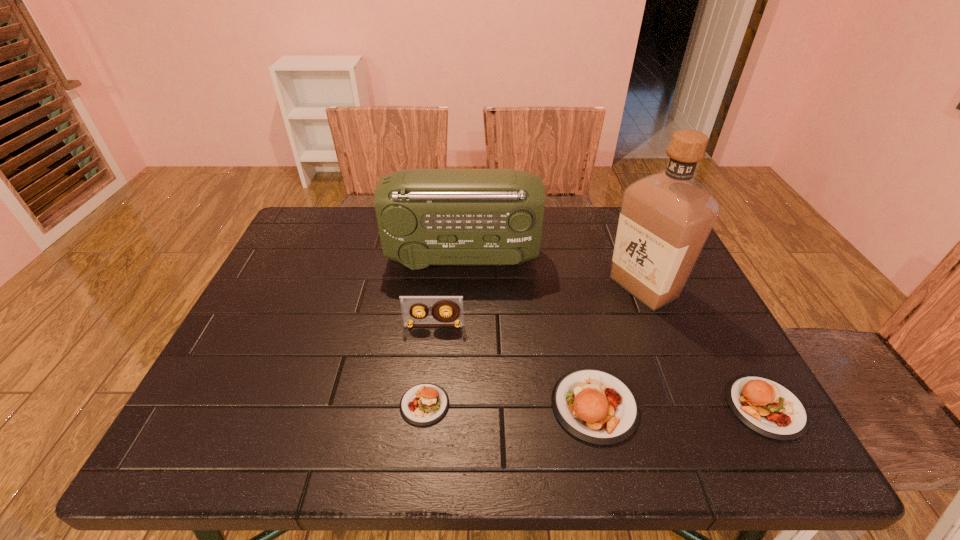
Identify the location of free spot between the second tallest patty (food) and the second tallest object. (613, 333).

This screenshot has height=540, width=960. In order to click on empty space between the second patty (food) from left to right and the rightmost patty (food) in this screenshot , I will do `click(680, 406)`.

At what (x,y) coordinates should I click in order to perform the action: click on vacant space that is in between the radio_receiver and the second patty (food) from left to right. Please return your answer as a coordinate pair (x, y). Looking at the image, I should click on (528, 332).

Identify the location of empty space between the radio_receiver and the fourth shortest object. (447, 292).

Image resolution: width=960 pixels, height=540 pixels. In order to click on free space between the rightmost patty (food) and the liquor in this screenshot , I will do `click(705, 347)`.

You are a GUI agent. You are given a task and a screenshot of the screen. Output one action in this format:
    pyautogui.click(x=<x>, y=<y>)
    Task: Click on the unoccupied position between the leftmost patty (food) and the third tallest object
    Image resolution: width=960 pixels, height=540 pixels.
    Given the screenshot: What is the action you would take?
    pyautogui.click(x=429, y=365)

You are a GUI agent. You are given a task and a screenshot of the screen. Output one action in this format:
    pyautogui.click(x=<x>, y=<y>)
    Task: Click on the unoccupied area between the second tallest patty (food) and the fourth nearest object
    The width and height of the screenshot is (960, 540).
    Given the screenshot: What is the action you would take?
    pyautogui.click(x=600, y=366)

Identify the location of empty location between the second patty (food) from left to right and the videotape. pyautogui.click(x=515, y=366).

Locate which object ranks fourth in proximity to the tallest object. Please provide its 2D coordinates. Your answer should be formatted as a tuple, i.e. [(x, y)], where the tuple contains the x and y coordinates of a point satisfying the conditions above.

[(410, 305)]

Find the location of a particular element. Image resolution: width=960 pixels, height=540 pixels. object identified as the second closest to the third farthest object is located at coordinates (426, 217).